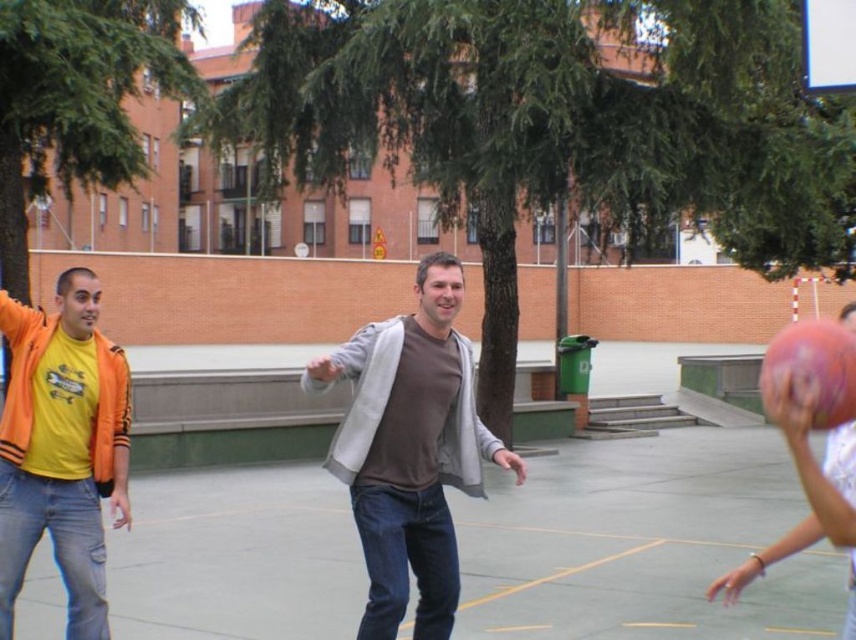
You are a photographer trying to capture a photo of the gray cotton sweater at center and the rubber basketball at right. Based on their positions, which object should you focus on first if you want to ensure both are in sharp focus?

The gray cotton sweater at center is located below the rubber basketball at right. To ensure both are in sharp focus, you should focus on the gray cotton sweater at center first since it is closer to the camera, and the basketball at right will naturally fall into the depth of field.

You are standing at the point closer to the camera between the two points, point [810,404] and point [843,380]. Which point are you standing at?

You are standing at point [810,404] because it is further to the camera than point [843,380].